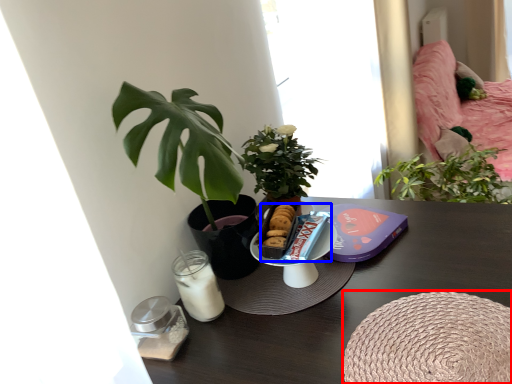
Question: Among these objects, which one is nearest to the camera, round table (highlighted by a red box) or snack (highlighted by a blue box)?

Choices:
 (A) round table
 (B) snack

Answer: (A)